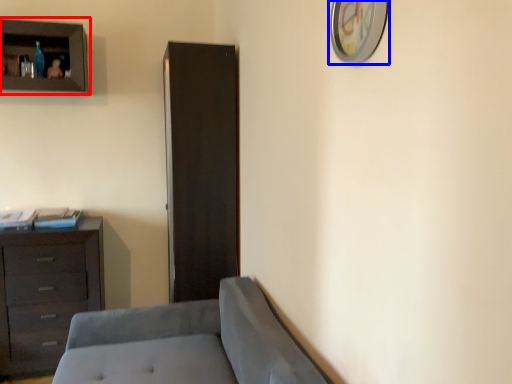
Question: Which object is further to the camera taking this photo, cupboard (highlighted by a red box) or picture frame (highlighted by a blue box)?

Choices:
 (A) cupboard
 (B) picture frame

Answer: (A)